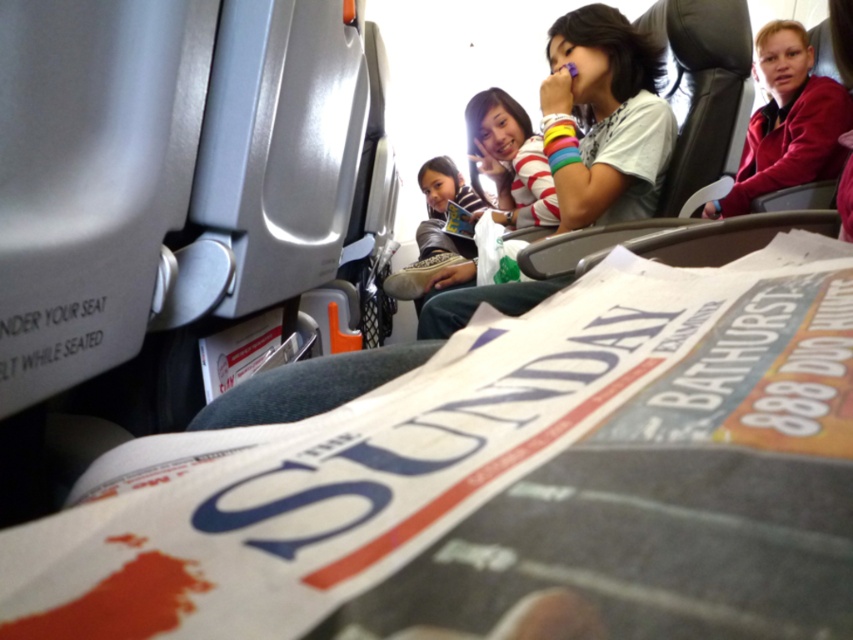
You are a passenger on a bus and you see the white glossy newspaper at center and the white striped shirt at upper center. Which object is closer to you?

The white glossy newspaper at center is closer to you because it is in front of the white striped shirt at upper center.

You are a passenger on a bus and need to place a small item on the seat next to you. The seat is near the white glossy newspaper at center. Where should you place the item to avoid covering the newspaper?

Place the item away from the white glossy newspaper at center to ensure it doesn not cover it. Since the newspaper is located at point (x=505, y=483), placing the item elsewhere on the seat will keep it uncovered.

What is the location of the point with coordinates (505, 483) in the image?

The point with coordinates (505, 483) is located on the white glossy newspaper at center.